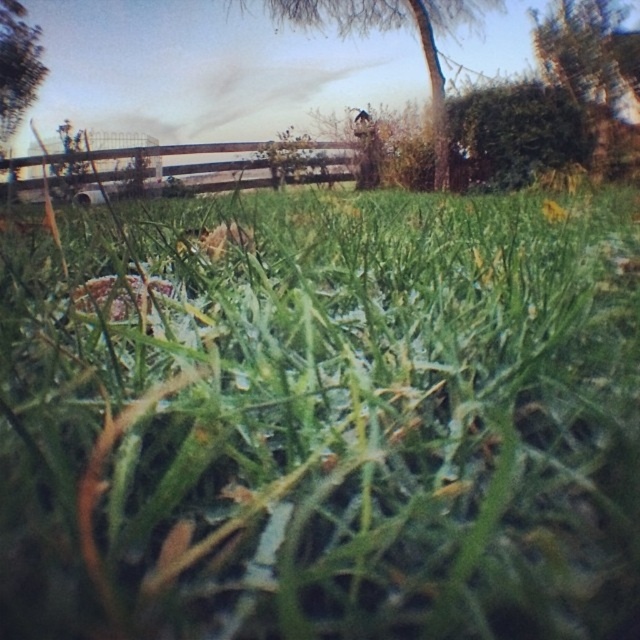
The height and width of the screenshot is (640, 640). What do you see at coordinates (330, 426) in the screenshot?
I see `green matte grass at center` at bounding box center [330, 426].

Does green matte grass at center have a greater width compared to green leafy tree at upper left?

Yes.

Does point (168, 326) come farther from viewer compared to point (1, 129)?

No, it is not.

Locate an element on the screen. This screenshot has height=640, width=640. green matte grass at center is located at coordinates (330, 426).

Does green matte grass at center have a smaller size compared to green leafy tree at upper center?

No.

Which is more to the left, green matte grass at center or green leafy tree at upper center?

green matte grass at center is more to the left.

The width and height of the screenshot is (640, 640). Identify the location of green matte grass at center. coord(330,426).

Measure the distance from green leafy tree at upper right to green leafy tree at upper left.

14.32 meters

Which is below, green leafy tree at upper right or green leafy tree at upper left?

Positioned lower is green leafy tree at upper right.

Where is `green leafy tree at upper right`? The image size is (640, 640). green leafy tree at upper right is located at coordinates (586, 51).

Find the location of a particular element. This screenshot has height=640, width=640. green leafy tree at upper right is located at coordinates (586, 51).